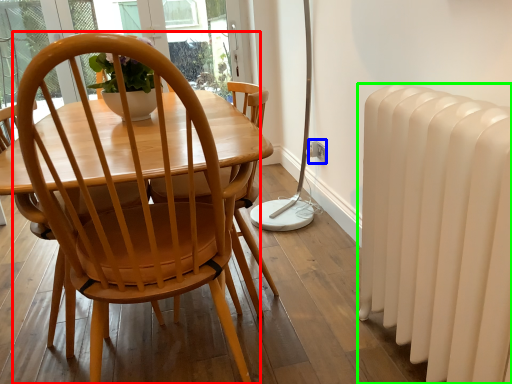
Question: Which object is positioned farthest from chair (highlighted by a red box)? Select from power outlet (highlighted by a blue box) and radiator (highlighted by a green box).

Choices:
 (A) power outlet
 (B) radiator

Answer: (A)